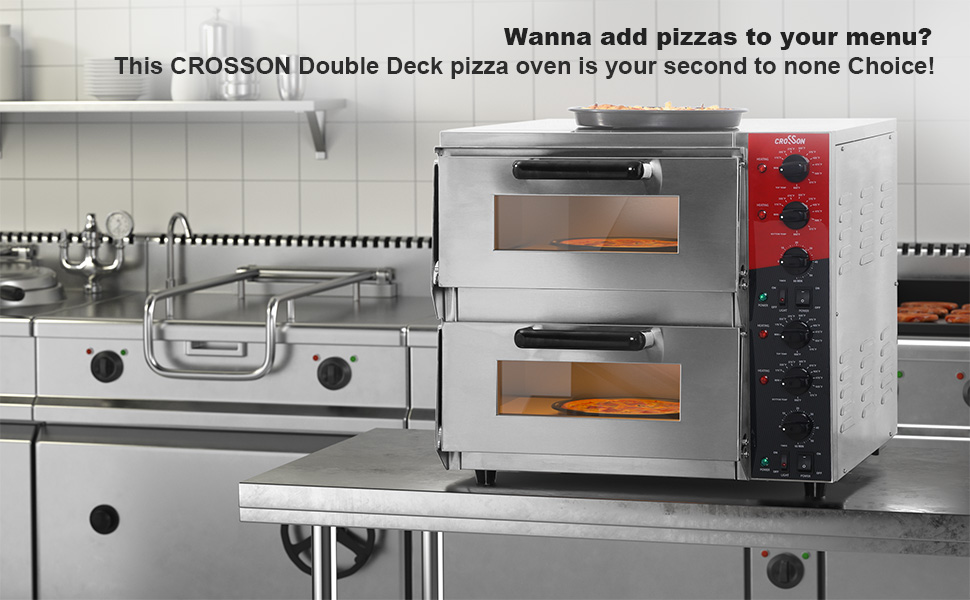
Locate an element on the screen. tiled wall is located at coordinates (118, 164).